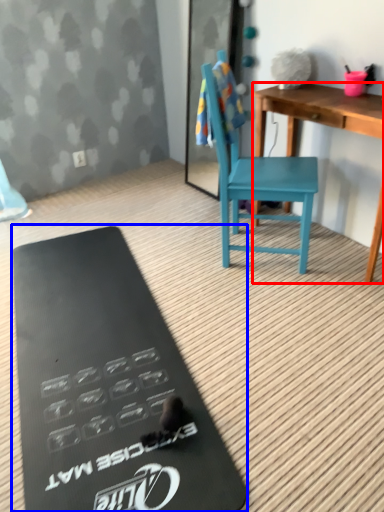
Question: Which point is closer to the camera, desk (highlighted by a red box) or clipboard (highlighted by a blue box)?

Choices:
 (A) desk
 (B) clipboard

Answer: (B)